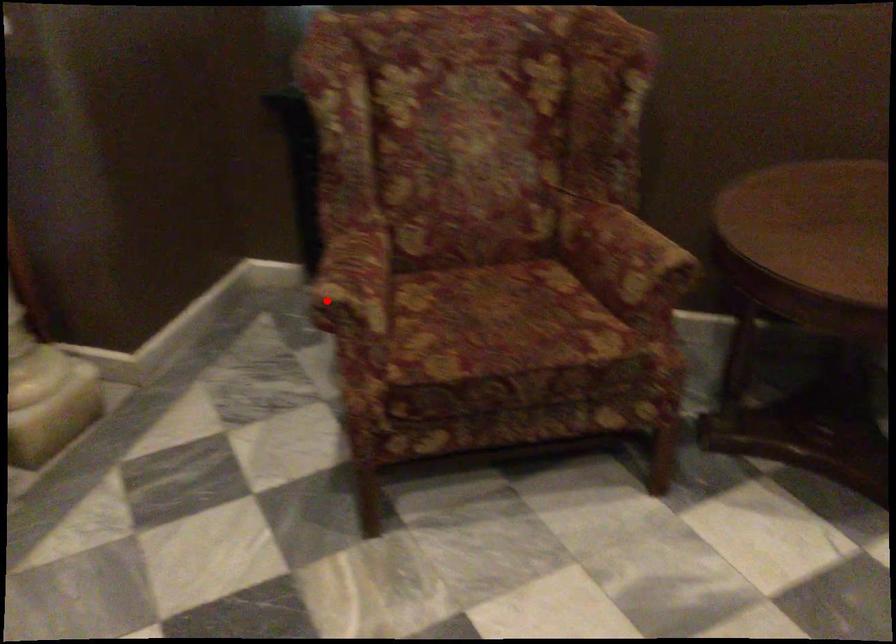
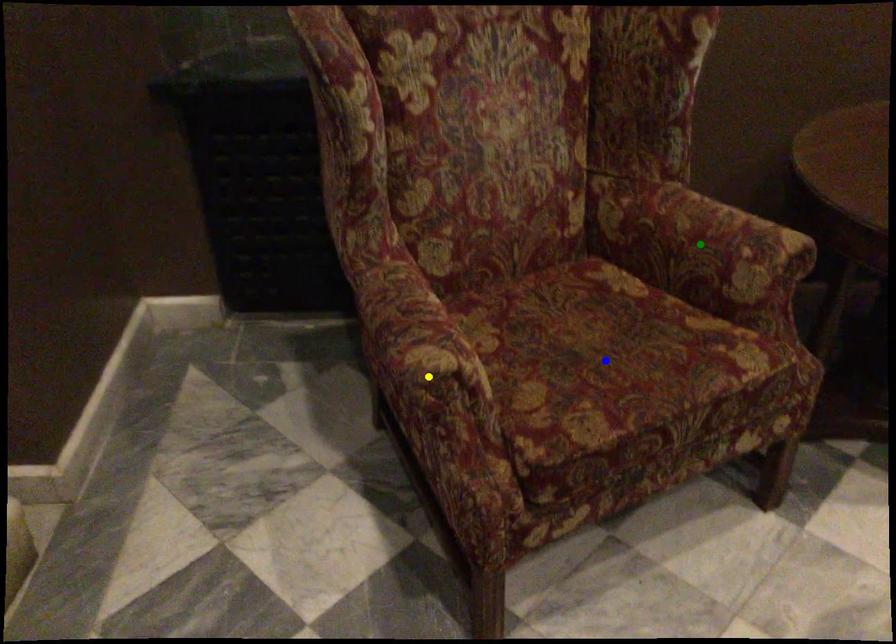
Question: I am providing you with two images of the same scene from different viewpoints. A red point is marked on the first image. You are given multiple points on the second image. Which point in image 2 represents the same 3d spot as the red point in image 1?

Choices:
 (A) green point
 (B) yellow point
 (C) blue point

Answer: (B)